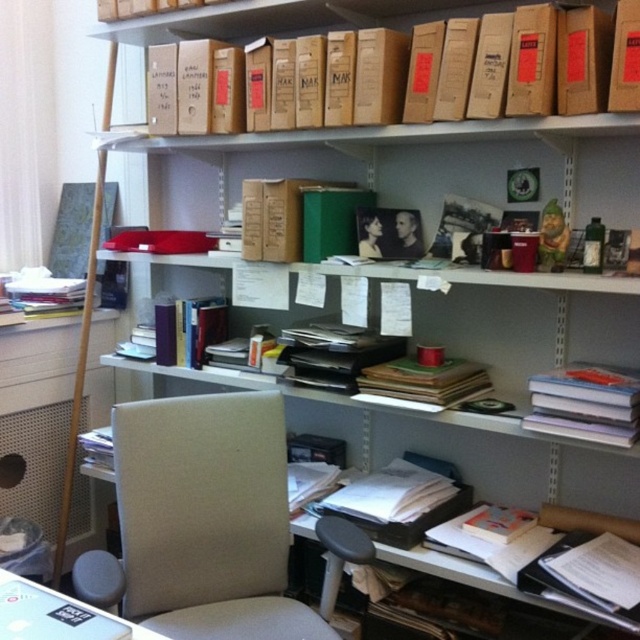
You are standing in the cluttered workspace and want to reach a specific item located at point [570,433]. There is an obstacle at point [394,392]. Can you reach the item without moving the obstacle?

Point [570,433] is in front of point [394,392], so yes, you can reach the item at point [570,433] without moving the obstacle at point [394,392] because it is closer to you.